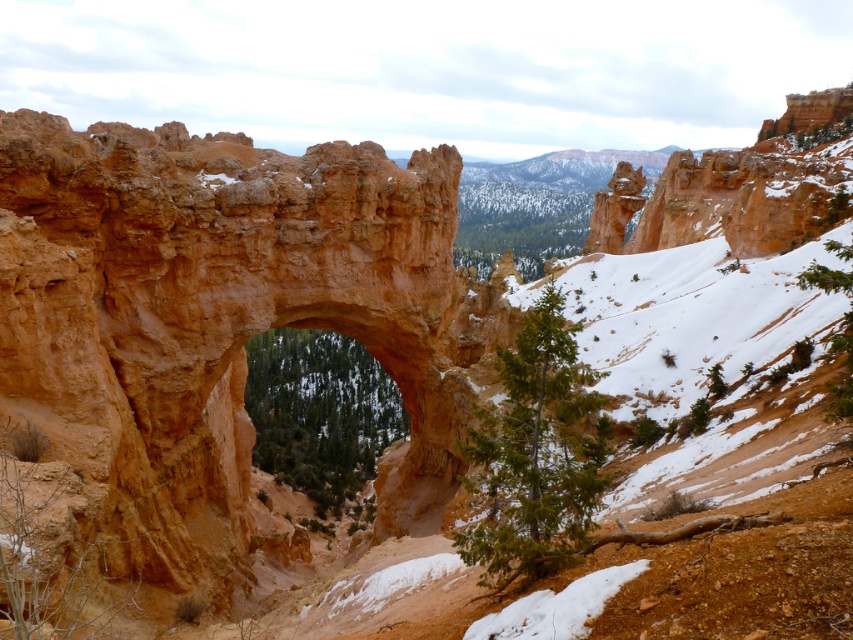
Question: Which of the following is the farthest from the observer?

Choices:
 (A) (844, 284)
 (B) (289, 342)
 (C) (590, 472)

Answer: (B)

Question: Is green matte tree at center below green textured tree at lower right?

Choices:
 (A) no
 (B) yes

Answer: (B)

Question: Where is green textured tree at center located in relation to green textured tree at lower right in the image?

Choices:
 (A) right
 (B) left

Answer: (B)

Question: Which object is farther from the camera taking this photo?

Choices:
 (A) green textured tree at center
 (B) green textured tree at lower right

Answer: (B)

Question: Does green textured tree at center appear over green textured tree at lower right?

Choices:
 (A) yes
 (B) no

Answer: (B)

Question: Which point is farther from the camera taking this photo?

Choices:
 (A) (822, 272)
 (B) (297, 401)
 (C) (550, 376)

Answer: (B)